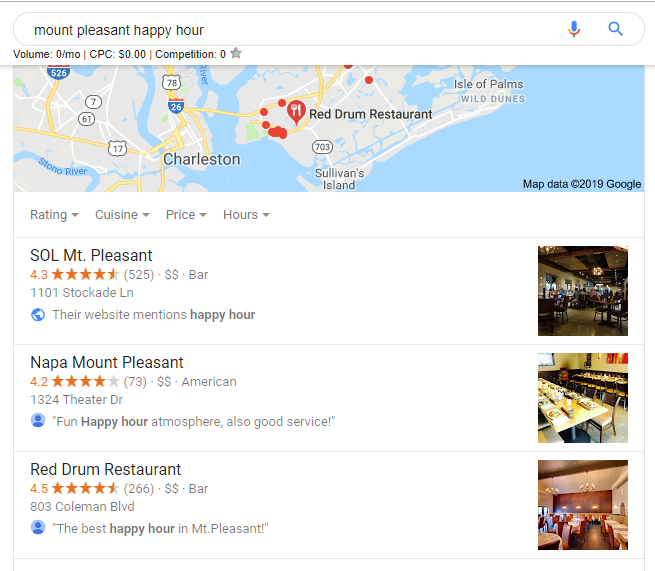
What are the coordinates of `floor` in the screenshot? It's located at (588, 317).